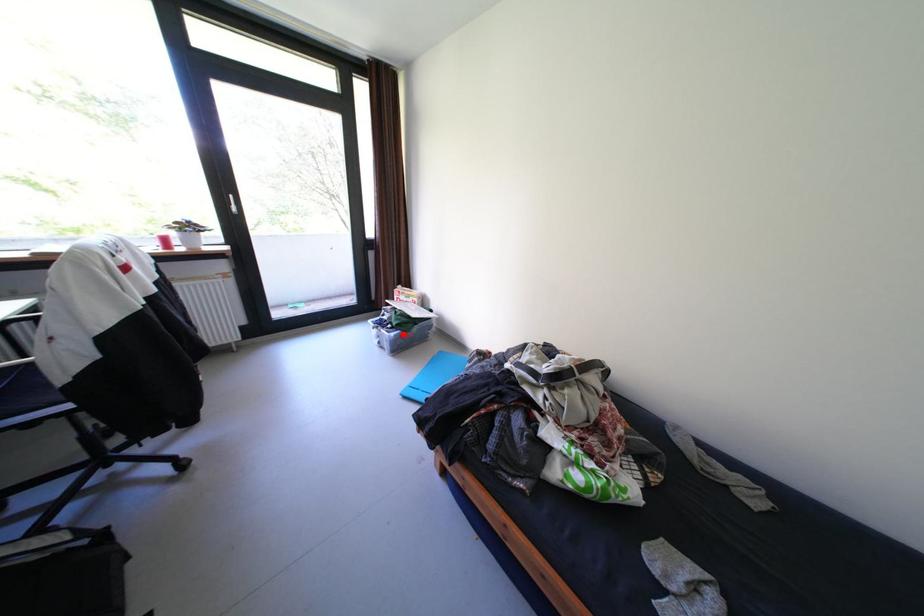
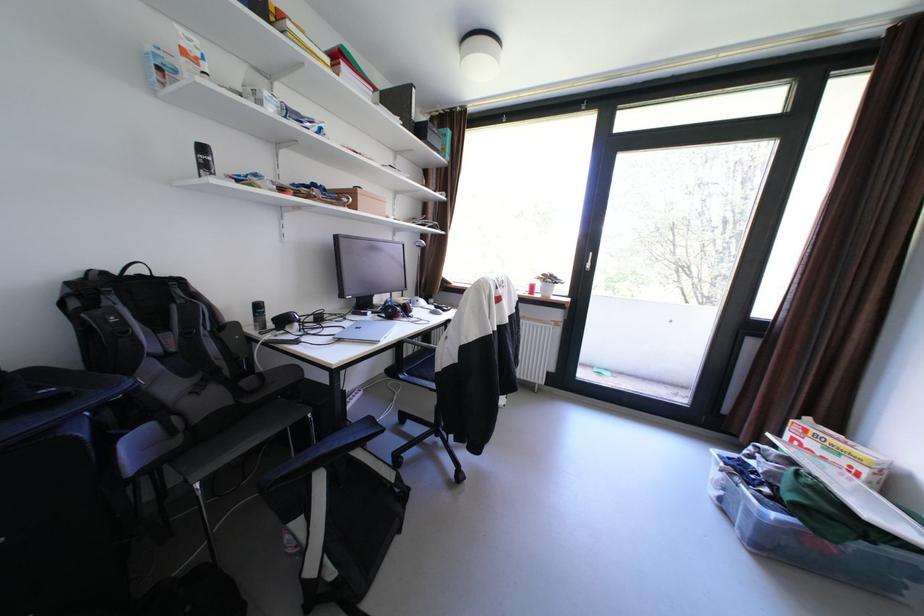
Question: A red point is marked in image1. In image2, is the corresponding 3D point closer to the camera or farther? Reply with the corresponding letter.

Choices:
 (A) The corresponding 3D point is closer.
 (B) The corresponding 3D point is farther.

Answer: (A)